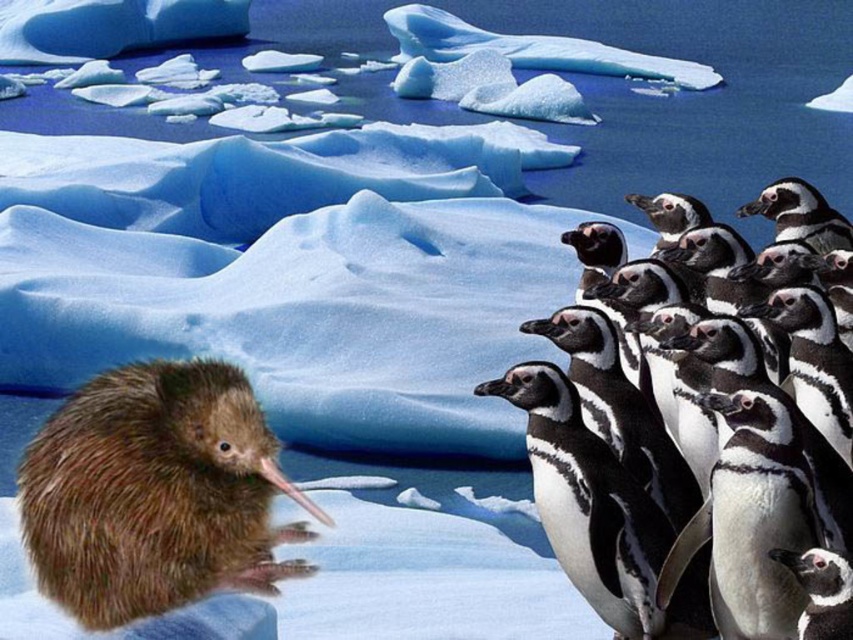
Based on the photo, does brown fuzzy kiwi at lower left appear under black and white feathers at right?

Yes, brown fuzzy kiwi at lower left is below black and white feathers at right.

Is brown fuzzy kiwi at lower left bigger than black and white feathers at right?

No, brown fuzzy kiwi at lower left is not bigger than black and white feathers at right.

Does point (247, 385) come behind point (735, 237)?

That is False.

Identify the location of brown fuzzy kiwi at lower left. Image resolution: width=853 pixels, height=640 pixels. (155, 493).